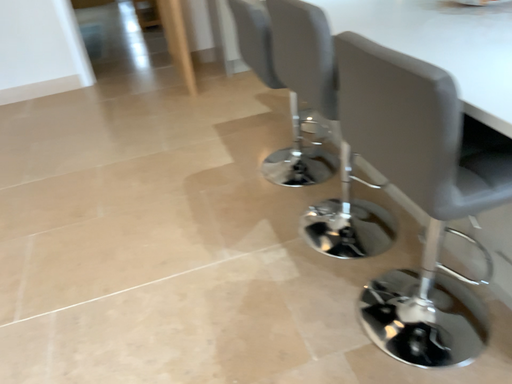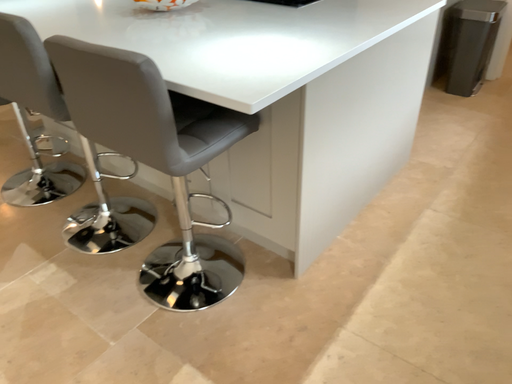
Question: How did the camera likely rotate when shooting the video?

Choices:
 (A) rotated upward
 (B) rotated downward

Answer: (A)